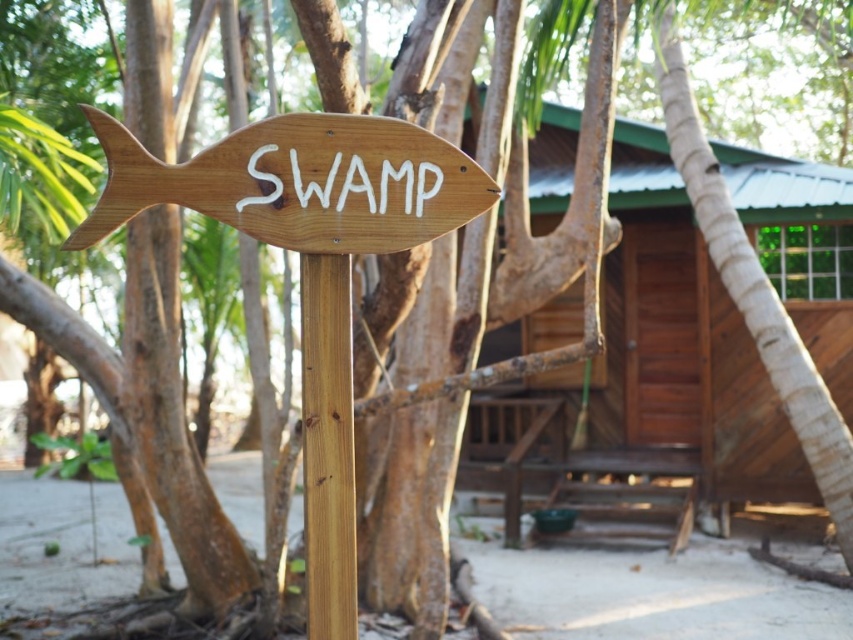
You are standing at the point marked by the coordinates point (698,369) in the image. What object are you directly facing?

You are directly facing the brown wooden hut at center, as the point (698,369) marks its location.

You are a delivery person with a cart that is 2 meters wide. You need to move your cart from the brown wooden hut at center to the light brown wood pole at center. Is there enough space between them for your cart to pass through?

The distance between the brown wooden hut at center and the light brown wood pole at center is 4.13 meters, which is wider than the cart width of 2 meters. Yes, there is enough space for the cart to pass through.

You are designing a garden path and want to place the natural wood fish sign at left and the light brown wood pole at center along the path. If you want to ensure both items are visible from a distance, which one should you place closer to the path entrance?

The natural wood fish sign at left has a greater width than the light brown wood pole at center, so placing it closer to the path entrance will make it more visible from a distance.